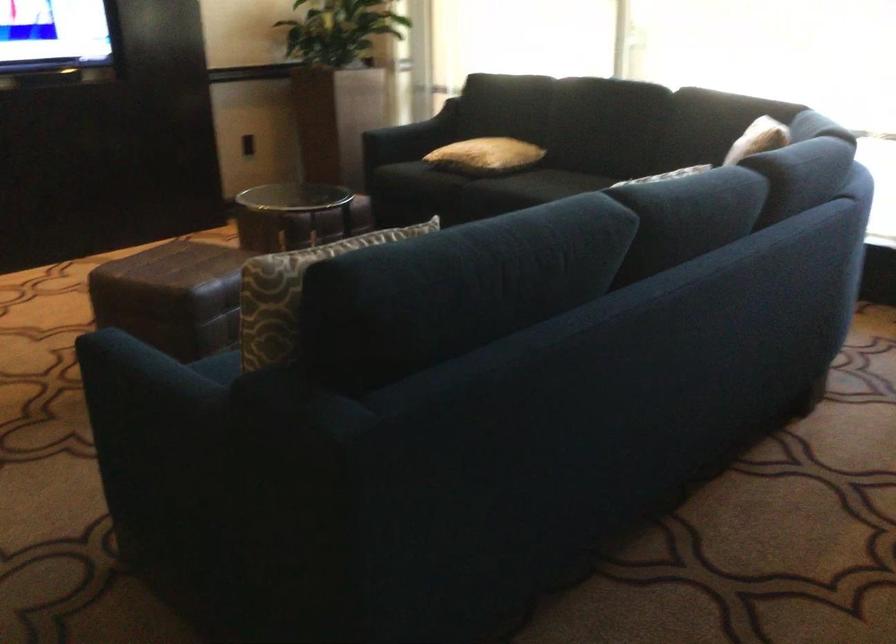
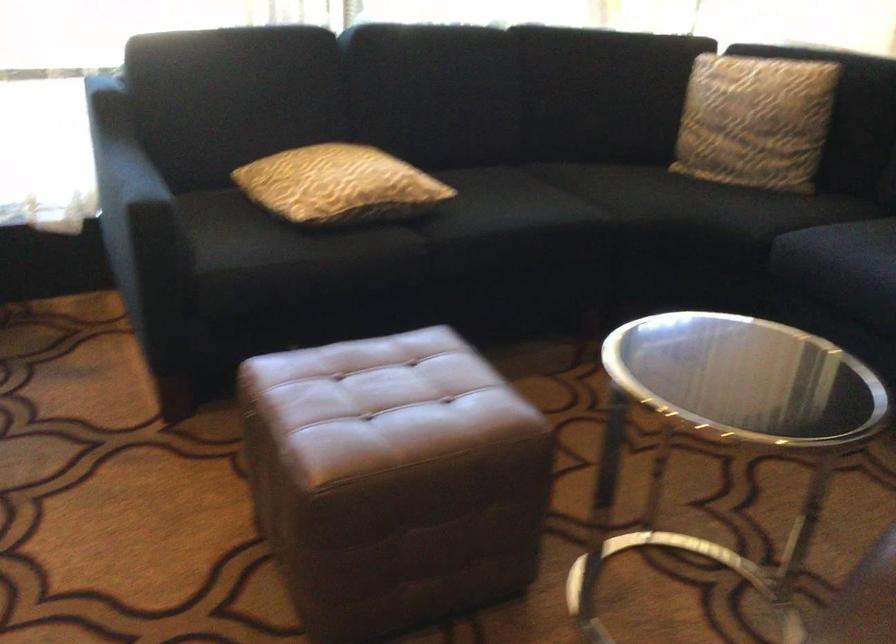
Where in the second image is the point corresponding to the point at 458,147 from the first image?

(339, 185)